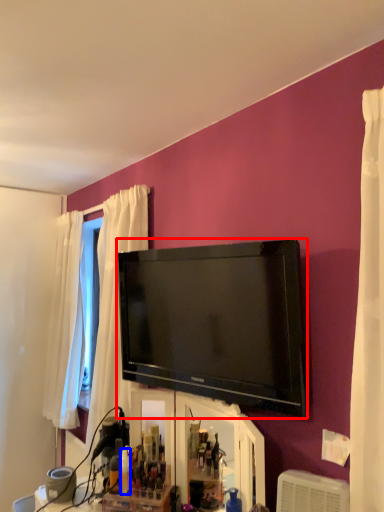
Question: Which of the following is the farthest to the observer, television (highlighted by a red box) or toiletry (highlighted by a blue box)?

Choices:
 (A) television
 (B) toiletry

Answer: (B)